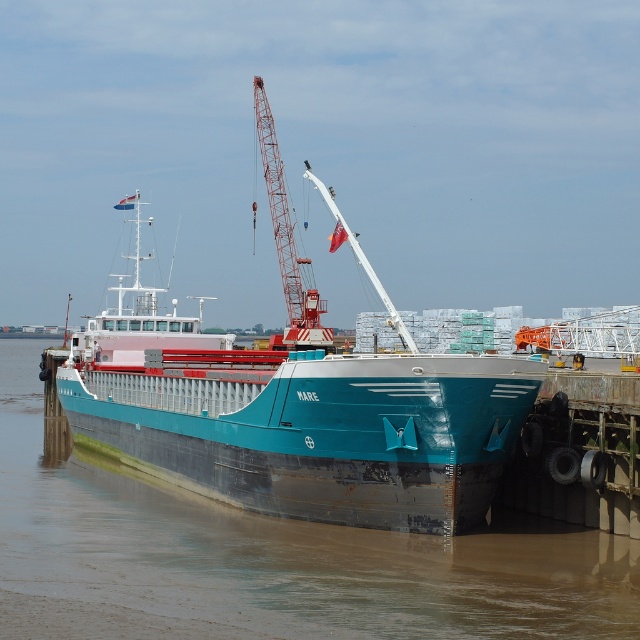
You are standing on the dock and looking at the scene. Which object is nearer to you between the teal metallic water at lower left and the teal matte barge at center?

The teal metallic water at lower left is closer to the viewer than the teal matte barge at center.

You are standing on the deck of the barge NARE and want to move from point (300, 451) to point (262, 84). Which direction should you move to get closer to the crane?

To move from point (300, 451) to point (262, 84), you should move towards the crane because point (262, 84) is farther from the viewer than point (300, 451), meaning it is closer to the crane which is positioned above the deck.